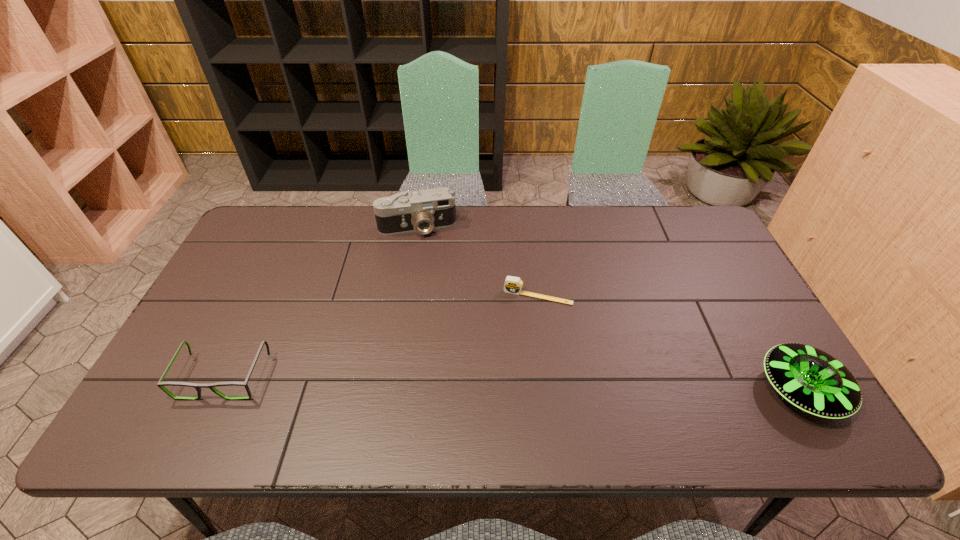
At what (x,y) coordinates should I click in order to perform the action: click on free space located 0.270m on the lens of the tallest object. Please return your answer as a coordinate pair (x, y). The width and height of the screenshot is (960, 540). Looking at the image, I should click on (437, 300).

What are the coordinates of `free region located 0.370m on the lens of the tallest object` in the screenshot? It's located at (443, 327).

Locate an element on the screen. The height and width of the screenshot is (540, 960). vacant area situated 0.140m at the front of the third object from left to right with the tape extended is located at coordinates (519, 345).

What are the coordinates of `free region located at the front of the third object from left to right with the tape extended` in the screenshot? It's located at (505, 399).

Identify the location of vacant region located at the front of the third object from left to right with the tape extended. The width and height of the screenshot is (960, 540). (516, 354).

Find the location of a particular element. The height and width of the screenshot is (540, 960). object situated at the far edge is located at coordinates (405, 212).

What are the coordinates of `spectacles located at the near edge` in the screenshot? It's located at (160, 384).

Identify the location of saucer situated at the near edge. (810, 379).

Identify the location of object present at the left edge. This screenshot has width=960, height=540. (160, 384).

You are a GUI agent. You are given a task and a screenshot of the screen. Output one action in this format:
    pyautogui.click(x=<x>, y=<y>)
    Task: Click on the object that is at the right edge
    
    Given the screenshot: What is the action you would take?
    pyautogui.click(x=810, y=379)